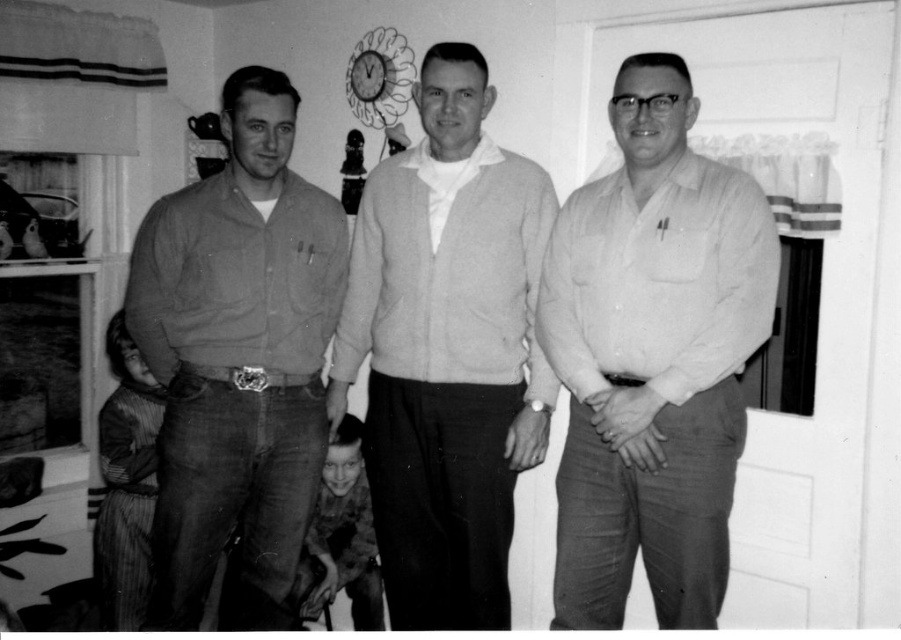
Question: Among these objects, which one is nearest to the camera?

Choices:
 (A) light gray sweater at center
 (B) matte brown shirt at left

Answer: (B)

Question: Which object is positioned farthest from the light gray sweater at center?

Choices:
 (A) white smooth shirt at center
 (B) matte brown shirt at left

Answer: (B)

Question: Which point is closer to the camera?

Choices:
 (A) (405, 609)
 (B) (187, 374)
 (C) (658, 627)

Answer: (C)

Question: Can you confirm if light gray sweater at center is bigger than matte brown shirt at left?

Choices:
 (A) no
 (B) yes

Answer: (B)

Question: From the image, what is the correct spatial relationship of white smooth shirt at center in relation to matte brown shirt at left?

Choices:
 (A) left
 (B) right

Answer: (B)

Question: Is light gray sweater at center thinner than matte brown shirt at left?

Choices:
 (A) yes
 (B) no

Answer: (B)